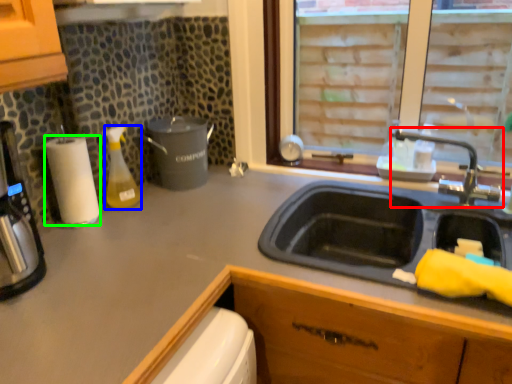
Question: Which object is the farthest from tap (highlighted by a red box)? Choose among these: bottle (highlighted by a blue box) or paper towel (highlighted by a green box).

Choices:
 (A) bottle
 (B) paper towel

Answer: (B)